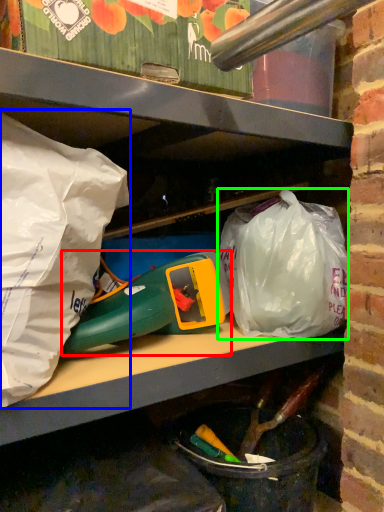
Question: Which object is positioned closest to toy (highlighted by a red box)? Select from plastic bag (highlighted by a blue box) and plastic bag (highlighted by a green box).

Choices:
 (A) plastic bag
 (B) plastic bag

Answer: (B)